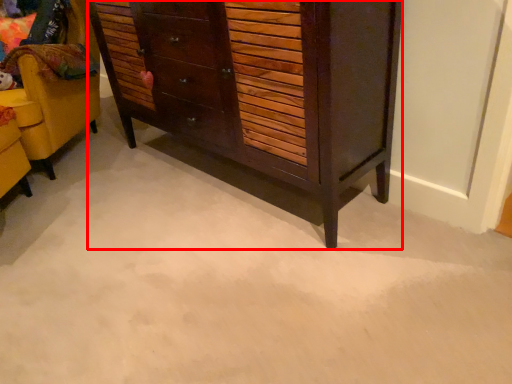
Question: From the image's perspective, what is the correct spatial positioning of chest of drawers (annotated by the red box) in reference to furniture?

Choices:
 (A) below
 (B) above

Answer: (A)